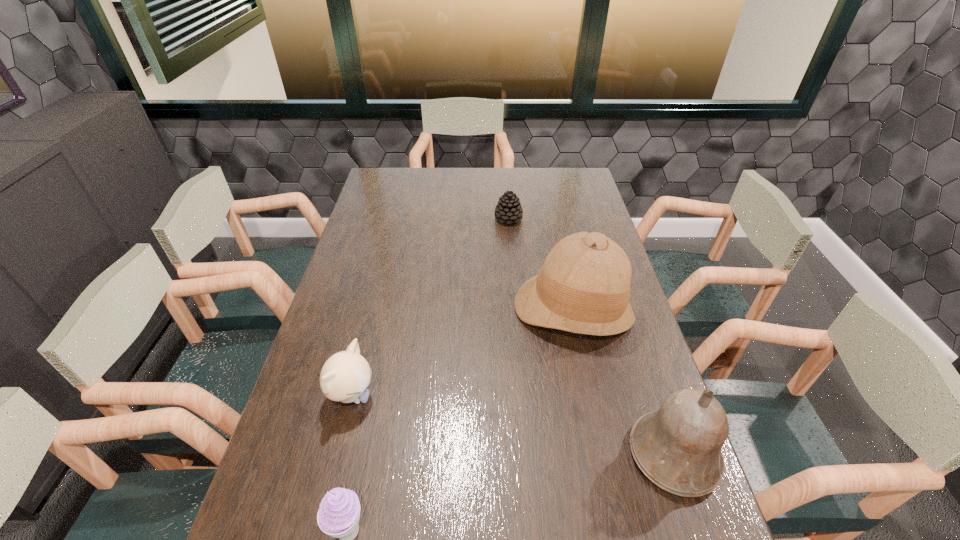
Find the location of a particular element. The height and width of the screenshot is (540, 960). the fourth shortest object is located at coordinates (678, 448).

Locate an element on the screen. This screenshot has width=960, height=540. pinecone is located at coordinates (508, 209).

Where is `the farthest object`? The height and width of the screenshot is (540, 960). the farthest object is located at coordinates (508, 209).

Where is `kitten`? kitten is located at coordinates (345, 376).

You are a GUI agent. You are given a task and a screenshot of the screen. Output one action in this format:
    pyautogui.click(x=<x>, y=<y>)
    Task: Click on the tallest object
    The height and width of the screenshot is (540, 960).
    Given the screenshot: What is the action you would take?
    pyautogui.click(x=583, y=287)

At what (x,y) coordinates should I click in order to perform the action: click on the second farthest object. Please return your answer as a coordinate pair (x, y). This screenshot has height=540, width=960. Looking at the image, I should click on (583, 287).

You are a GUI agent. You are given a task and a screenshot of the screen. Output one action in this format:
    pyautogui.click(x=<x>, y=<y>)
    Task: Click on the vacant area located on the left of the second tallest object
    
    Given the screenshot: What is the action you would take?
    pyautogui.click(x=589, y=455)

Where is `vacant space situated at the narrow end of the shortest object`? vacant space situated at the narrow end of the shortest object is located at coordinates (513, 255).

Locate an element on the screen. Image resolution: width=960 pixels, height=540 pixels. vacant space located 0.240m at the narrow end of the shortest object is located at coordinates (515, 268).

The height and width of the screenshot is (540, 960). Find the location of `free space located 0.140m at the narrow end of the shortest object`. free space located 0.140m at the narrow end of the shortest object is located at coordinates (513, 250).